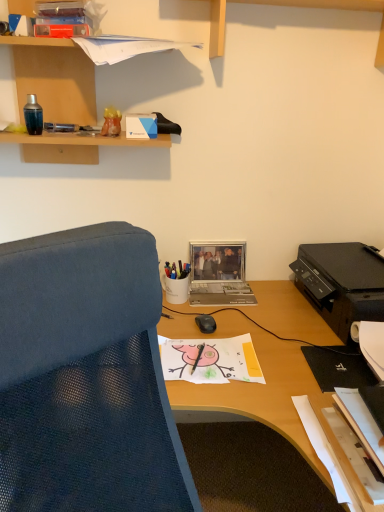
Question: Considering the relative sizes of metallic silver laptop at center and metallic pen at upper left, positioned as the first pen in left-to-right order, in the image provided, is metallic silver laptop at center taller than metallic pen at upper left, positioned as the first pen in left-to-right order,?

Choices:
 (A) no
 (B) yes

Answer: (B)

Question: From the image's perspective, is metallic silver laptop at center below metallic pen at upper left, the second pen from the front?

Choices:
 (A) no
 (B) yes

Answer: (B)

Question: Considering the relative sizes of metallic silver laptop at center and metallic pen at upper left, which is the first pen from back to front, in the image provided, is metallic silver laptop at center bigger than metallic pen at upper left, which is the first pen from back to front,?

Choices:
 (A) no
 (B) yes

Answer: (B)

Question: Considering the relative positions of metallic silver laptop at center and metallic pen at upper left, marked as the first pen in a top-to-bottom arrangement, in the image provided, is metallic silver laptop at center behind metallic pen at upper left, marked as the first pen in a top-to-bottom arrangement,?

Choices:
 (A) yes
 (B) no

Answer: (A)

Question: Is metallic silver laptop at center located outside metallic pen at upper left, the second pen from the bottom?

Choices:
 (A) yes
 (B) no

Answer: (A)

Question: Is metallic silver laptop at center directly adjacent to metallic pen at upper left, the 2th pen when ordered from right to left?

Choices:
 (A) yes
 (B) no

Answer: (B)

Question: From the image's perspective, does white glossy pen holder at center, the second stationery when ordered from left to right, appear higher than wooden shelf at upper left?

Choices:
 (A) yes
 (B) no

Answer: (B)

Question: Is white glossy pen holder at center, the second stationery when ordered from left to right, behind wooden shelf at upper left?

Choices:
 (A) no
 (B) yes

Answer: (B)

Question: Is white glossy pen holder at center, which ranks as the second stationery in front-to-back order, not close to wooden shelf at upper left?

Choices:
 (A) no
 (B) yes

Answer: (A)

Question: Considering the relative sizes of white glossy pen holder at center, which is counted as the 1th stationery, starting from the bottom, and wooden shelf at upper left in the image provided, is white glossy pen holder at center, which is counted as the 1th stationery, starting from the bottom, bigger than wooden shelf at upper left?

Choices:
 (A) no
 (B) yes

Answer: (A)

Question: Can you confirm if white glossy pen holder at center, the 2th stationery positioned from the top, is taller than wooden shelf at upper left?

Choices:
 (A) yes
 (B) no

Answer: (B)

Question: From a real-world perspective, is white glossy pen holder at center, the first stationery in the back-to-front sequence, beneath wooden shelf at upper left?

Choices:
 (A) no
 (B) yes

Answer: (B)

Question: From a real-world perspective, is metallic silver laptop at center over black matte pen at center, which is the first pen in bottom-to-top order?

Choices:
 (A) no
 (B) yes

Answer: (B)